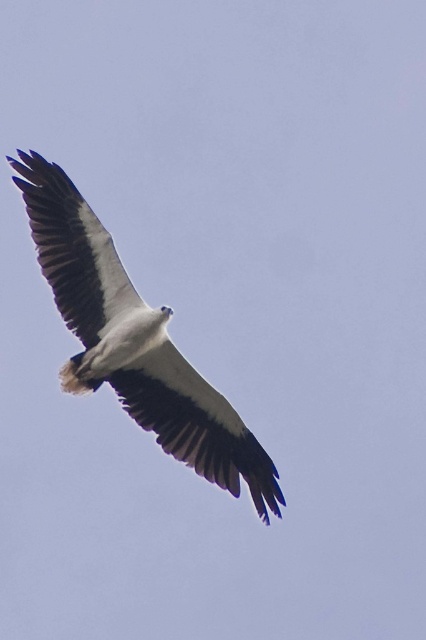
Question: Which point is closer to the camera?

Choices:
 (A) white feathered wing at center
 (B) white feathered wing at upper left

Answer: (A)

Question: Is white feathered eagle at center below white feathered wing at upper left?

Choices:
 (A) yes
 (B) no

Answer: (A)

Question: Can you confirm if white feathered eagle at center is positioned to the left of white feathered wing at upper left?

Choices:
 (A) no
 (B) yes

Answer: (A)

Question: Which object is closer to the camera taking this photo?

Choices:
 (A) white feathered eagle at center
 (B) white feathered wing at center

Answer: (A)

Question: Which object appears farthest from the camera in this image?

Choices:
 (A) white feathered eagle at center
 (B) white feathered wing at upper left

Answer: (B)

Question: Is white feathered eagle at center above white feathered wing at upper left?

Choices:
 (A) yes
 (B) no

Answer: (B)